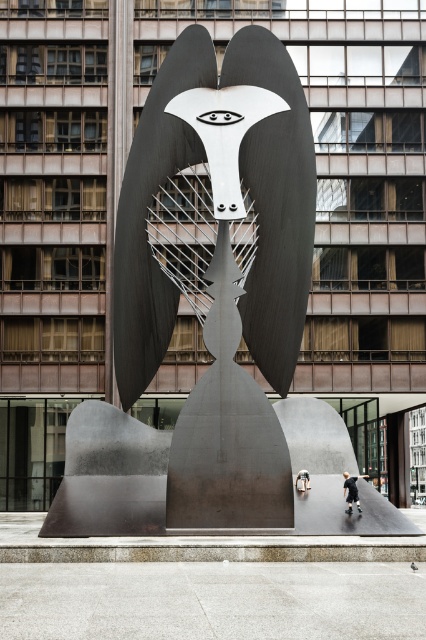
Question: Among these points, which one is nearest to the camera?

Choices:
 (A) (301, 474)
 (B) (252, 465)
 (C) (359, 509)

Answer: (B)

Question: Among these objects, which one is nearest to the camera?

Choices:
 (A) black matte skateboarder at center
 (B) polished steel sculpture at center

Answer: (B)

Question: Is polished steel sculpture at center wider than metallic silver figure at center?

Choices:
 (A) no
 (B) yes

Answer: (B)

Question: Which object is closer to the camera taking this photo?

Choices:
 (A) metallic silver figure at center
 (B) black matte skateboarder at center
 (C) polished steel sculpture at center

Answer: (C)

Question: Can you confirm if polished steel sculpture at center is thinner than black matte skateboarder at center?

Choices:
 (A) yes
 (B) no

Answer: (B)

Question: Does polished steel sculpture at center have a larger size compared to black matte skateboarder at center?

Choices:
 (A) yes
 (B) no

Answer: (A)